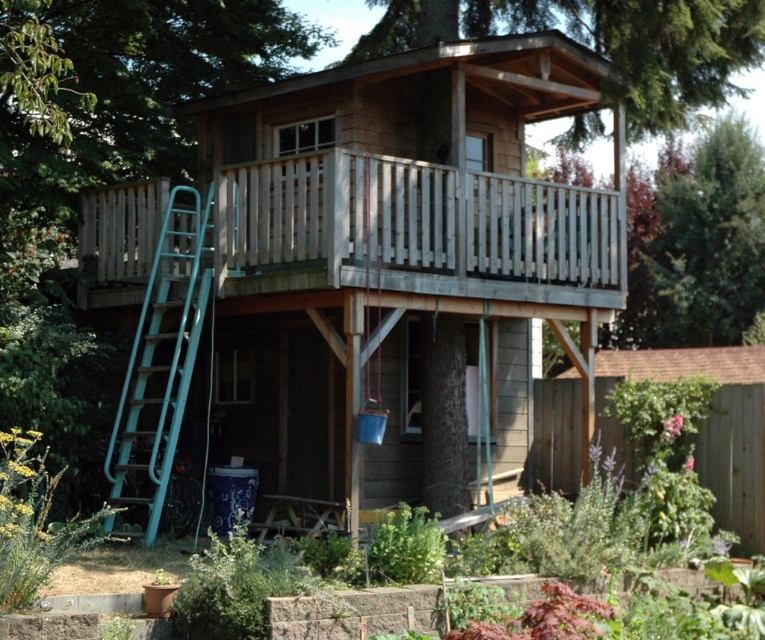
You are standing at the base of the treehouse and want to reach the weathered wood porch at upper center. Based on the coordinates provided, can you estimate the direction you should walk to reach it?

The weathered wood porch at upper center is located at coordinates point (415, 230), so you should walk towards the upper center direction to reach it.

You are standing at the base of the treehouse and want to reach the wooden deck at upper center. Which direction should you move in to get there?

The wooden deck at upper center is located at point 0.412 on the x axis and 0.460 on the y axis. Since you are at the base, you should move upward and toward the center to reach it.

You are standing at the entrance of the treehouse and want to reach the wooden deck at upper center. According to the coordinates provided, where exactly is the wooden deck positioned relative to your current location?

The wooden deck at upper center is located at coordinates point [350,262], which places it slightly to the upper center position from your current location at the entrance.